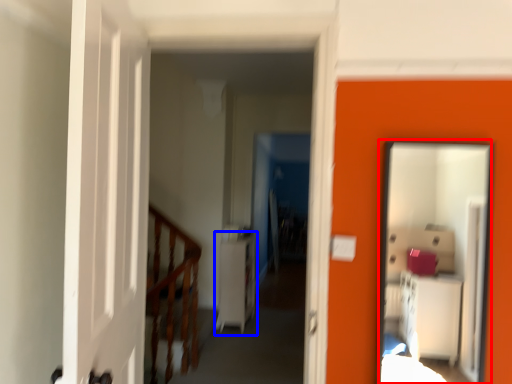
Question: Among these objects, which one is nearest to the camera, mirror (highlighted by a red box) or dresser (highlighted by a blue box)?

Choices:
 (A) mirror
 (B) dresser

Answer: (A)